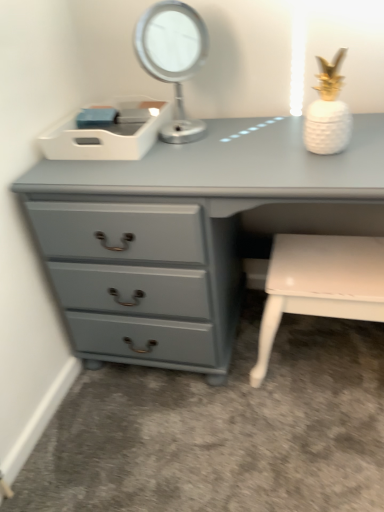
Identify the location of free location to the left of white glossy bench at lower right. This screenshot has width=384, height=512. (213, 400).